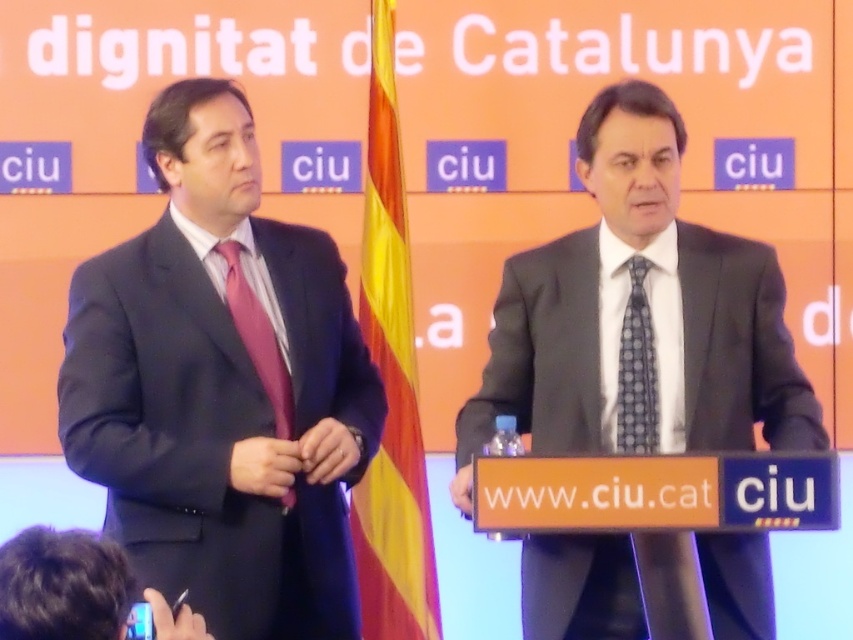
Is matte black suit at center taller than dark suit at lower left?

Yes, matte black suit at center is taller than dark suit at lower left.

Is matte black suit at center in front of dark suit at lower left?

No, it is not.

At what (x,y) coordinates should I click in order to perform the action: click on matte black suit at center. Please return your answer as a coordinate pair (x, y). Looking at the image, I should click on (648, 308).

Is point (753, 404) more distant than point (283, 410)?

No, it is in front of (283, 410).

Between matte black suit at center and matte pink tie at left, which one is positioned lower?

matte black suit at center

Is point (675, 620) positioned after point (236, 248)?

No, (675, 620) is in front of (236, 248).

Where is `matte black suit at center`? matte black suit at center is located at coordinates (648, 308).

Is matte black suit at left below matte pink tie at left?

Yes.

What do you see at coordinates (222, 387) in the screenshot? This screenshot has width=853, height=640. I see `matte black suit at left` at bounding box center [222, 387].

The image size is (853, 640). Find the location of `matte black suit at left`. matte black suit at left is located at coordinates (222, 387).